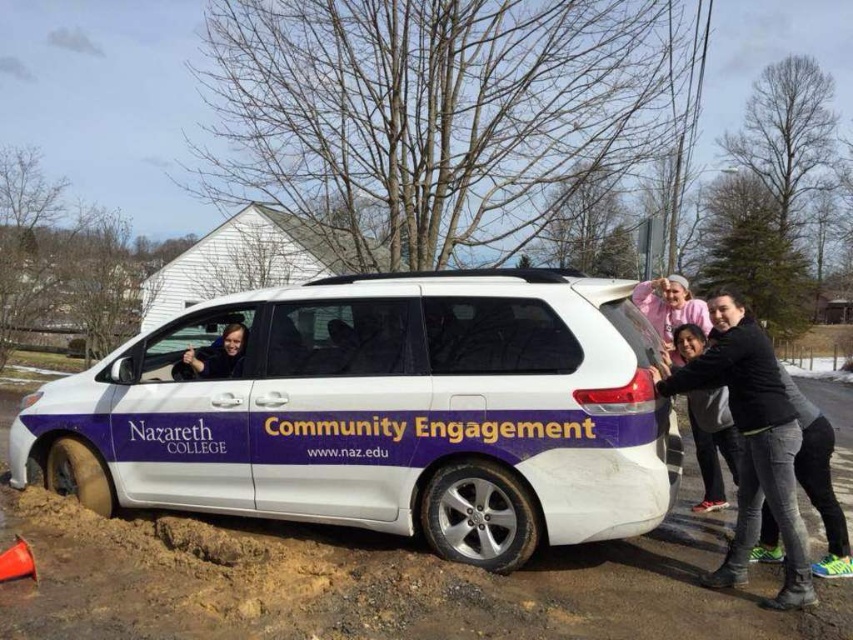
Question: Can you confirm if black matte shirt at center is wider than matte black face at center?

Choices:
 (A) yes
 (B) no

Answer: (A)

Question: Does white matte van at center appear on the right side of black matte shirt at center?

Choices:
 (A) no
 (B) yes

Answer: (A)

Question: Estimate the real-world distances between objects in this image. Which object is closer to the matte black face at center?

Choices:
 (A) black matte shirt at center
 (B) white matte van at center

Answer: (B)

Question: Is black matte shirt at center below matte black face at center?

Choices:
 (A) yes
 (B) no

Answer: (A)

Question: Among these points, which one is farthest from the camera?

Choices:
 (A) (186, 360)
 (B) (341, 362)

Answer: (A)

Question: Which point is farther to the camera?

Choices:
 (A) (202, 364)
 (B) (718, 584)
 (C) (102, 474)

Answer: (C)